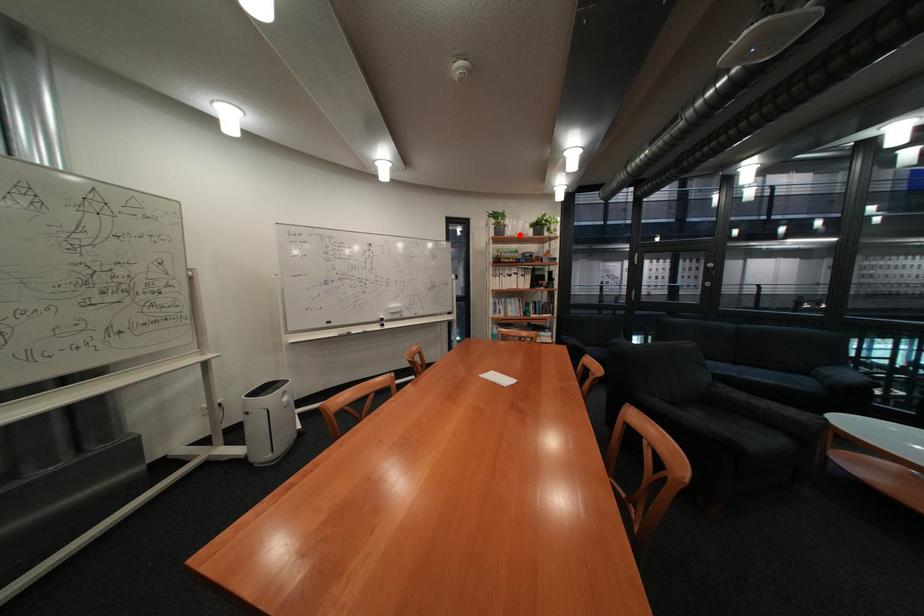
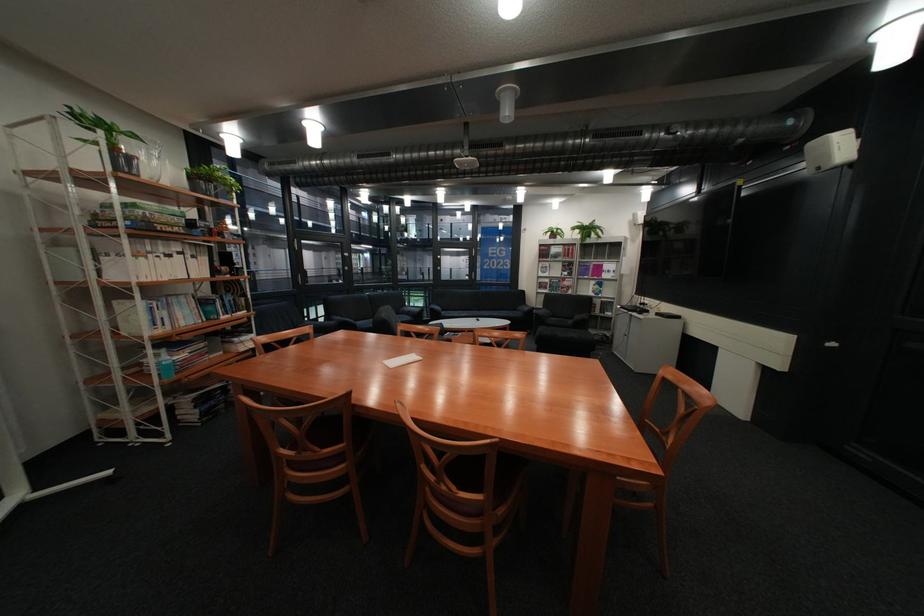
Question: I am providing you with two images of the same scene from different viewpoints. A red point is marked on the first image. Can you still see the location of the red point in image 2?

Choices:
 (A) Yes
 (B) No

Answer: (A)